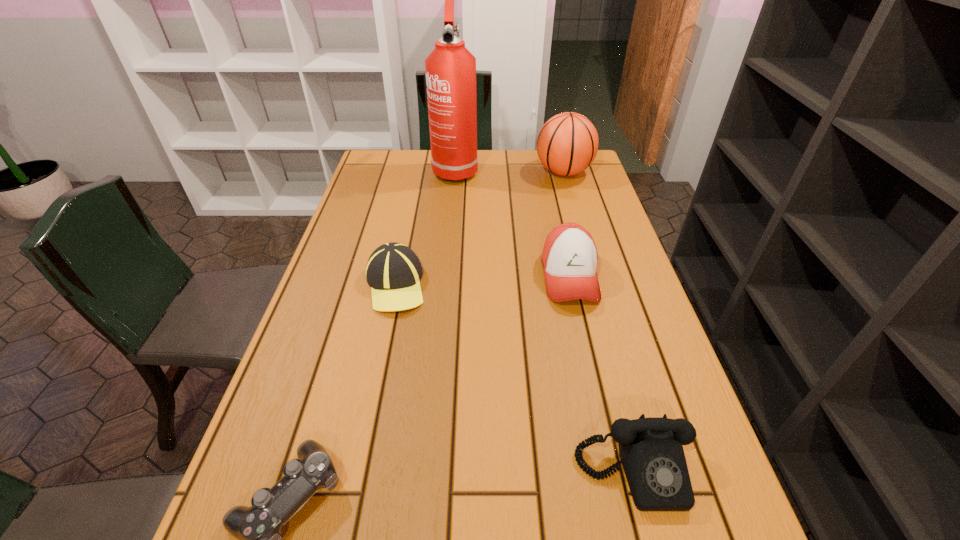
Find the location of a particular element. Image resolution: width=960 pixels, height=540 pixels. the tallest object is located at coordinates tap(450, 68).

Find the location of a particular element. The height and width of the screenshot is (540, 960). basketball is located at coordinates (567, 144).

This screenshot has width=960, height=540. In order to click on the taller baseball cap in this screenshot , I will do `click(569, 258)`.

Where is `the third tallest object`? The height and width of the screenshot is (540, 960). the third tallest object is located at coordinates 569,258.

Where is `the left baseball cap`? the left baseball cap is located at coordinates (393, 271).

What are the coordinates of `telephone` in the screenshot? It's located at (650, 449).

Identify the location of vacant space located 0.340m at the nozzle of the fire extinguisher. This screenshot has width=960, height=540. (448, 251).

This screenshot has width=960, height=540. Identify the location of vacant region located 0.360m on the front of the fifth shortest object. (588, 258).

I want to click on free space located 0.360m on the front-facing side of the taller baseball cap, so click(612, 463).

The height and width of the screenshot is (540, 960). In order to click on vacant space located with the brim of the shorter baseball cap facing forward in this screenshot , I will do `click(359, 456)`.